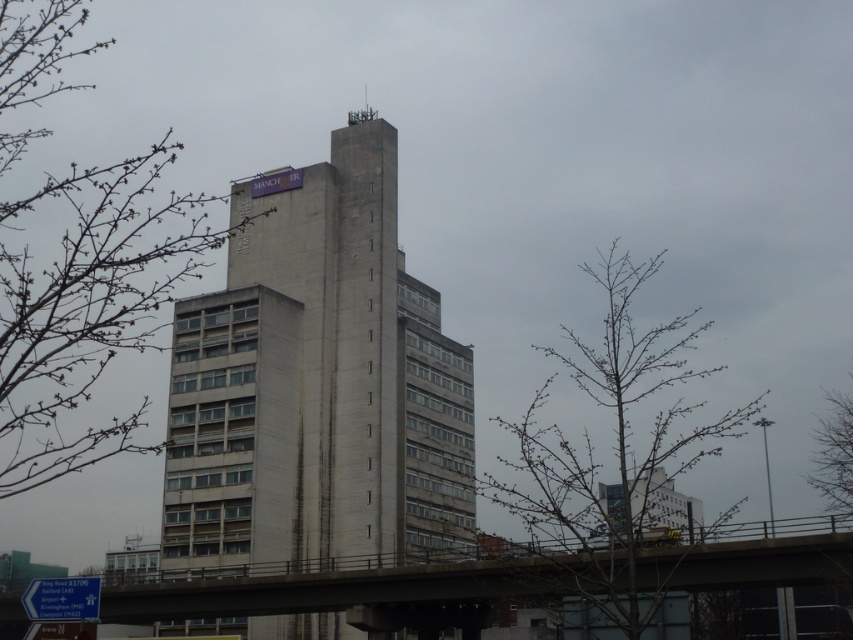
Between point (463, 408) and point (834, 396), which one is positioned behind?

The point (834, 396) is behind.

This screenshot has height=640, width=853. I want to click on concrete building at center, so click(317, 385).

Is point (209, 513) positioned behind point (845, 486)?

No.

You are a GUI agent. You are given a task and a screenshot of the screen. Output one action in this format:
    pyautogui.click(x=<x>, y=<y>)
    Task: Click on the concrete building at center
    Image resolution: width=853 pixels, height=640 pixels.
    Given the screenshot: What is the action you would take?
    pyautogui.click(x=317, y=385)

Who is higher up, bare branches at upper left or bare branches at lower right?

bare branches at upper left is above.

You are a GUI agent. You are given a task and a screenshot of the screen. Output one action in this format:
    pyautogui.click(x=<x>, y=<y>)
    Task: Click on the bare branches at upper left
    The height and width of the screenshot is (640, 853).
    Given the screenshot: What is the action you would take?
    pyautogui.click(x=88, y=305)

Does concrete bridge at lower center appear under blue plastic sign at lower left?

Indeed, concrete bridge at lower center is positioned under blue plastic sign at lower left.

Can you confirm if concrete bridge at lower center is smaller than blue plastic sign at lower left?

Incorrect, concrete bridge at lower center is not smaller in size than blue plastic sign at lower left.

Is point (236, 609) more distant than point (22, 602)?

Yes, it is.

I want to click on concrete bridge at lower center, so click(364, 588).